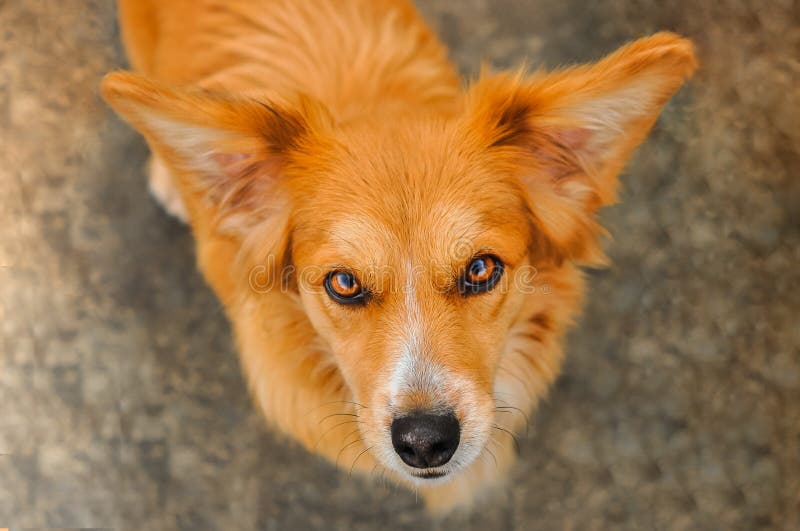
This screenshot has height=531, width=800. Find the location of `chest`. chest is located at coordinates (518, 389), (309, 398).